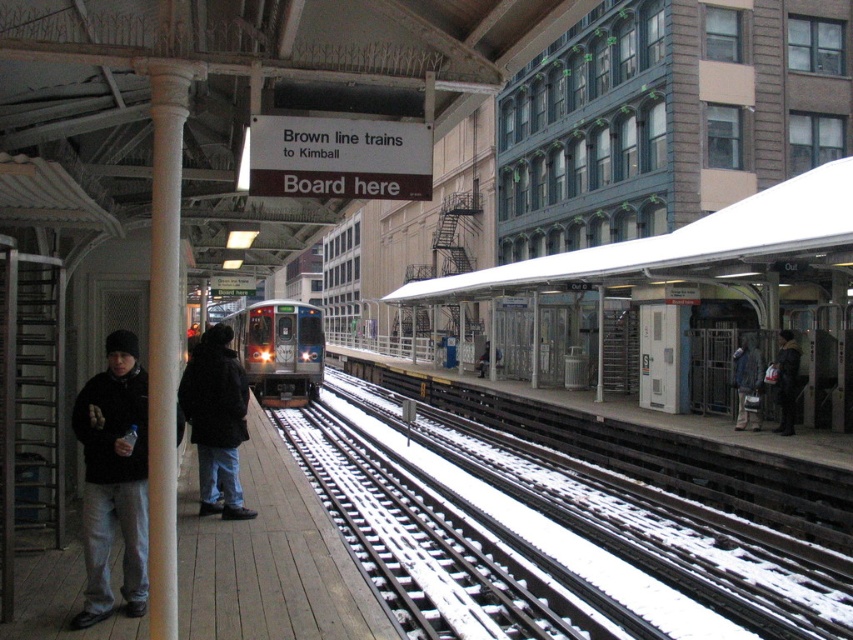
Consider the image. Between dark blue jacket at left and silver metallic train at center, which one appears on the left side from the viewer's perspective?

Positioned to the left is silver metallic train at center.

Describe the element at coordinates (216, 420) in the screenshot. The width and height of the screenshot is (853, 640). I see `dark blue jacket at left` at that location.

Find the location of a particular element. dark blue jacket at left is located at coordinates (216, 420).

This screenshot has width=853, height=640. Describe the element at coordinates (688, 237) in the screenshot. I see `white matte canopy at upper center` at that location.

You are a GUI agent. You are given a task and a screenshot of the screen. Output one action in this format:
    pyautogui.click(x=<x>, y=<y>)
    Task: Click on the white matte canopy at upper center
    This screenshot has height=640, width=853.
    Given the screenshot: What is the action you would take?
    pyautogui.click(x=688, y=237)

Does white matte canopy at upper center appear over dark brown leather jacket at right?

Yes.

Can you confirm if white matte canopy at upper center is positioned to the right of dark brown leather jacket at right?

Correct, you'll find white matte canopy at upper center to the right of dark brown leather jacket at right.

Is point (801, 216) closer to viewer compared to point (787, 406)?

Yes, it is.

Find the location of a particular element. Image resolution: width=853 pixels, height=640 pixels. white matte canopy at upper center is located at coordinates (688, 237).